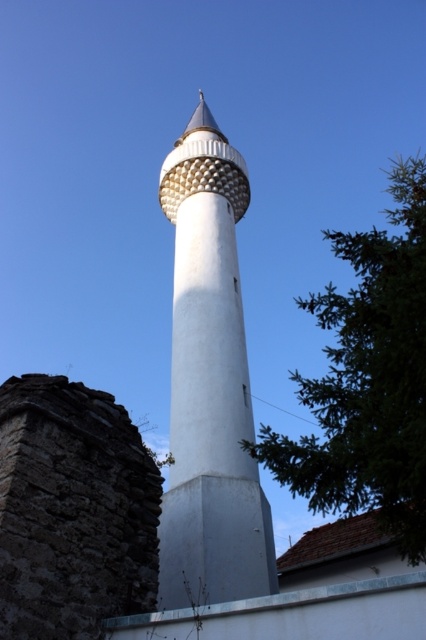
You are standing in front of the scene and want to take a photo of the white smooth minaret at center. If your camera can only focus on objects within a 0.5 unit radius centered at the origin, will the minaret be in focus?

The white smooth minaret at center is located at point [210,385]. The distance from the origin to this point is sqrt0.603 squared plus 0.493 squared, which is approximately sqrt0.603 squared is [210,232] squared is 0.243, total 0.6066, square root is about 0.779. Since 0.779 is greater than 0.5, the minaret is outside the focus range and will not be in focus.

You are standing in front of the image and want to walk towards the green leafy tree at center right. Which direction should you move relative to the white smooth minaret at center?

Since the white smooth minaret at center is to the left of the green leafy tree at center right, you should move to the right of the white smooth minaret at center to reach the green leafy tree at center right.

You are planning to install a new pathway between the white smooth minaret at center and the green leafy tree at center right. The pathway requires a minimum clearance of 60 feet between the two landmarks to accommodate a straight walkway. Based on the scene, will the existing distance allow for this installation?

The distance between the white smooth minaret at center and the green leafy tree at center right is 70.78 feet, which exceeds the required 60 feet clearance. Therefore, the pathway can be installed as planned.